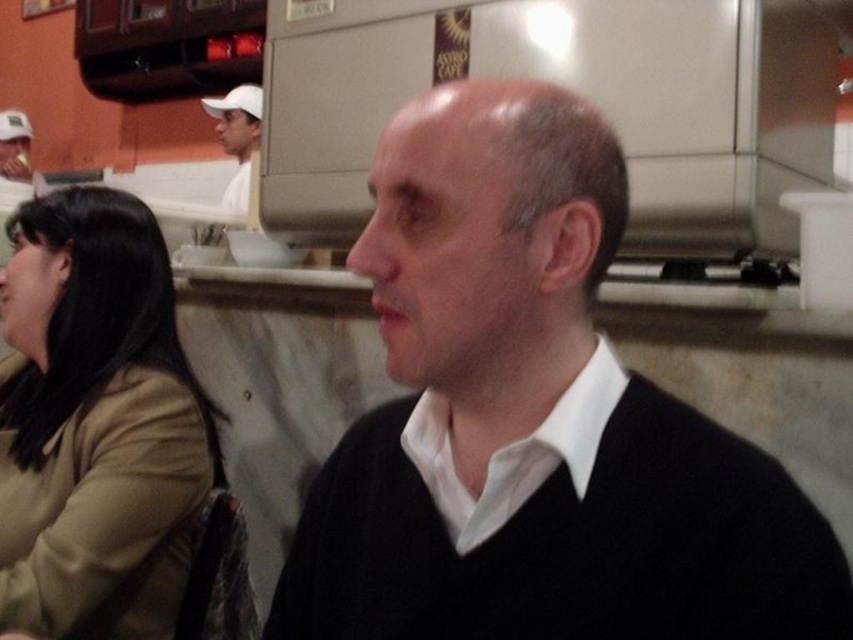
You are a customer at the diner and want to order a coffee. The barista asks you to point out the tan fabric coat at left and the matte white cap at upper left so they can bring your order to the correct table. Which object is wider?

The tan fabric coat at left is wider than the matte white cap at upper left.